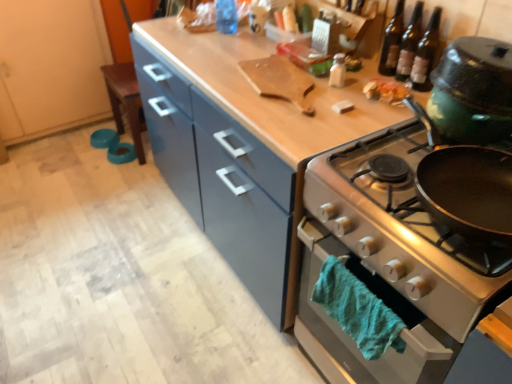
The width and height of the screenshot is (512, 384). Identify the location of vacant area in front of shiny plastic container at upper right. (383, 113).